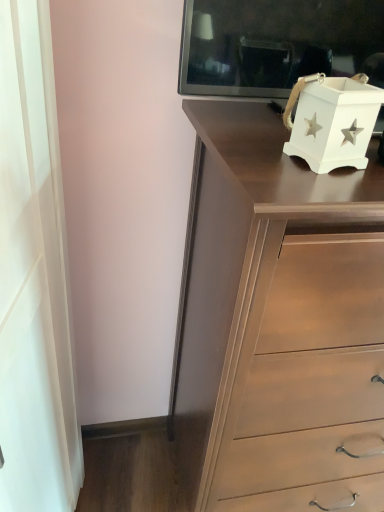
Question: From a real-world perspective, is matte brown chest of drawers at center over white matte curtain at left?

Choices:
 (A) yes
 (B) no

Answer: (B)

Question: Can you confirm if matte brown chest of drawers at center is positioned to the left of white matte curtain at left?

Choices:
 (A) yes
 (B) no

Answer: (B)

Question: Considering the relative sizes of matte brown chest of drawers at center and white matte curtain at left in the image provided, is matte brown chest of drawers at center wider than white matte curtain at left?

Choices:
 (A) no
 (B) yes

Answer: (B)

Question: From the image's perspective, is matte brown chest of drawers at center above white matte curtain at left?

Choices:
 (A) no
 (B) yes

Answer: (A)

Question: Considering the relative sizes of matte brown chest of drawers at center and white matte curtain at left in the image provided, is matte brown chest of drawers at center smaller than white matte curtain at left?

Choices:
 (A) no
 (B) yes

Answer: (A)

Question: Is matte brown chest of drawers at center next to white matte curtain at left and touching it?

Choices:
 (A) no
 (B) yes

Answer: (A)

Question: From a real-world perspective, is white matte box at upper right on top of matte brown chest of drawers at center?

Choices:
 (A) no
 (B) yes

Answer: (B)

Question: Is white matte box at upper right thinner than matte brown chest of drawers at center?

Choices:
 (A) no
 (B) yes

Answer: (B)

Question: Can you confirm if white matte box at upper right is taller than matte brown chest of drawers at center?

Choices:
 (A) yes
 (B) no

Answer: (B)

Question: From the image's perspective, would you say white matte box at upper right is shown under matte brown chest of drawers at center?

Choices:
 (A) no
 (B) yes

Answer: (A)

Question: Considering the relative positions of white matte box at upper right and matte brown chest of drawers at center in the image provided, is white matte box at upper right in front of matte brown chest of drawers at center?

Choices:
 (A) yes
 (B) no

Answer: (B)

Question: Is there a large distance between white matte box at upper right and matte brown chest of drawers at center?

Choices:
 (A) no
 (B) yes

Answer: (A)

Question: Are white matte curtain at left and matte brown chest of drawers at center beside each other?

Choices:
 (A) yes
 (B) no

Answer: (B)